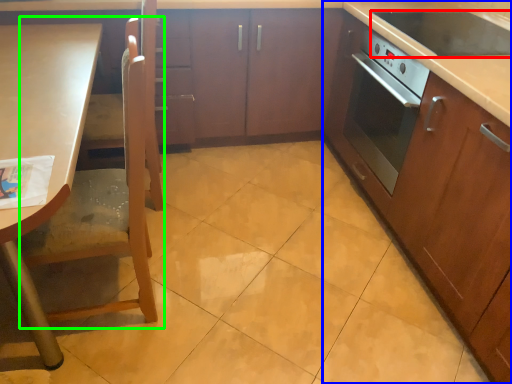
Question: Estimate the real-world distances between objects in this image. Which object is farther from kitchen appliance (highlighted by a red box), cabinetry (highlighted by a blue box) or chair (highlighted by a green box)?

Choices:
 (A) cabinetry
 (B) chair

Answer: (B)